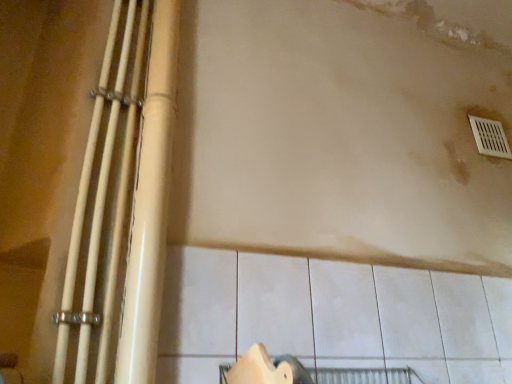
Question: Is white plastic vent at upper right with white glossy pipes at left, positioned as the first beam in left-to-right order?

Choices:
 (A) yes
 (B) no

Answer: (B)

Question: Does white plastic vent at upper right have a larger size compared to white glossy pipes at left, the 2th beam viewed from the right?

Choices:
 (A) yes
 (B) no

Answer: (B)

Question: Would you say white plastic vent at upper right is a long distance from white glossy pipes at left, positioned as the first beam in left-to-right order?

Choices:
 (A) yes
 (B) no

Answer: (A)

Question: From the image's perspective, is white plastic vent at upper right under white glossy pipes at left, the 2th beam viewed from the right?

Choices:
 (A) yes
 (B) no

Answer: (B)

Question: Does white plastic vent at upper right come behind white glossy pipes at left, the 2th beam viewed from the right?

Choices:
 (A) no
 (B) yes

Answer: (B)

Question: From the image's perspective, relative to white glossy pipes at left, positioned as the first beam in left-to-right order, is white plastic vent at upper right above or below?

Choices:
 (A) above
 (B) below

Answer: (A)

Question: Is point (502, 139) positioned closer to the camera than point (99, 188)?

Choices:
 (A) closer
 (B) farther

Answer: (B)

Question: Is white plastic vent at upper right situated inside white glossy pipes at left, positioned as the first beam in left-to-right order, or outside?

Choices:
 (A) outside
 (B) inside

Answer: (A)

Question: From a real-world perspective, relative to white glossy pipes at left, the 2th beam viewed from the right, is white plastic vent at upper right vertically above or below?

Choices:
 (A) below
 (B) above

Answer: (B)

Question: Considering their positions, is white plastic vent at upper right located in front of or behind matte beige pipes at left, the first beam positioned from the right?

Choices:
 (A) behind
 (B) front

Answer: (A)

Question: From the image's perspective, relative to matte beige pipes at left, which is counted as the second beam, starting from the left, is white plastic vent at upper right above or below?

Choices:
 (A) below
 (B) above

Answer: (B)

Question: In terms of width, does white plastic vent at upper right look wider or thinner when compared to matte beige pipes at left, the first beam positioned from the right?

Choices:
 (A) thin
 (B) wide

Answer: (A)

Question: Based on their positions, is white plastic vent at upper right located to the left or right of matte beige pipes at left, the first beam positioned from the right?

Choices:
 (A) right
 (B) left

Answer: (A)

Question: Considering the positions of point click(x=77, y=261) and point click(x=120, y=377), is point click(x=77, y=261) closer or farther from the camera than point click(x=120, y=377)?

Choices:
 (A) farther
 (B) closer

Answer: (A)

Question: From a real-world perspective, is white glossy pipes at left, positioned as the first beam in left-to-right order, above or below matte beige pipes at left, the first beam positioned from the right?

Choices:
 (A) above
 (B) below

Answer: (B)